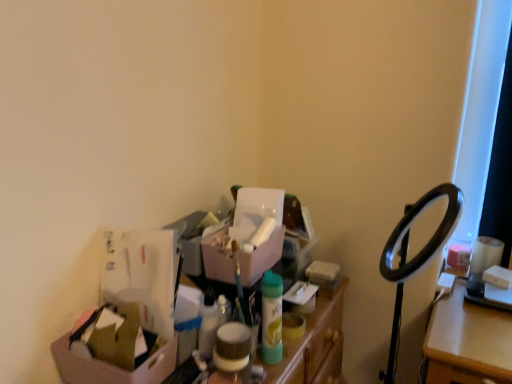
This screenshot has width=512, height=384. What do you see at coordinates (313, 345) in the screenshot? I see `matte plastic storage bin at center` at bounding box center [313, 345].

Image resolution: width=512 pixels, height=384 pixels. Describe the element at coordinates (112, 366) in the screenshot. I see `cardboard box at lower left, acting as the 1th box starting from the left` at that location.

Locate an element on the screen. Image resolution: width=512 pixels, height=384 pixels. matte plastic storage bin at center is located at coordinates (313, 345).

Looking at the image, does matte pink box at center, which ranks as the 2th box in bottom-to-top order, seem bigger or smaller compared to cardboard box at lower left, placed as the 2th box when sorted from back to front?

Clearly, matte pink box at center, which ranks as the 2th box in bottom-to-top order, is larger in size than cardboard box at lower left, placed as the 2th box when sorted from back to front.

Does matte pink box at center, which is counted as the first box, starting from the back, contain cardboard box at lower left, the first box in the bottom-to-top sequence?

Definitely not — cardboard box at lower left, the first box in the bottom-to-top sequence, is not inside matte pink box at center, which is counted as the first box, starting from the back.

From a real-world perspective, is matte pink box at center, which ranks as the 2th box in bottom-to-top order, positioned over cardboard box at lower left, acting as the 1th box starting from the left, based on gravity?

Yes, from a real-world perspective, matte pink box at center, which ranks as the 2th box in bottom-to-top order, is over cardboard box at lower left, acting as the 1th box starting from the left

Is matte pink box at center, positioned as the first box in top-to-bottom order, further to camera compared to cardboard box at lower left, the first box in the bottom-to-top sequence?

Yes, matte pink box at center, positioned as the first box in top-to-bottom order, is behind cardboard box at lower left, the first box in the bottom-to-top sequence.

Find the location of a particular element. Image resolution: width=512 pixels, height=384 pixels. the 2nd box to the left when counting from the matte plastic storage bin at center is located at coordinates (112, 366).

How far apart are matte plastic storage bin at center and cardboard box at lower left, placed as the 2th box when sorted from back to front?

They are 14.16 inches apart.

From their relative heights in the image, would you say matte plastic storage bin at center is taller or shorter than cardboard box at lower left, the first box in the bottom-to-top sequence?

matte plastic storage bin at center is taller than cardboard box at lower left, the first box in the bottom-to-top sequence.

Is point (332, 325) closer to viewer compared to point (75, 363)?

No, (332, 325) is further to viewer.

Considering their positions, is cardboard box at lower left, which is the second box in right-to-left order, located in front of or behind matte plastic storage bin at center?

Visually, cardboard box at lower left, which is the second box in right-to-left order, is located in front of matte plastic storage bin at center.

Which is more to the right, cardboard box at lower left, the first box in the bottom-to-top sequence, or matte plastic storage bin at center?

From the viewer's perspective, matte plastic storage bin at center appears more on the right side.

From the image's perspective, relative to matte plastic storage bin at center, is cardboard box at lower left, acting as the 1th box starting from the left, above or below?

cardboard box at lower left, acting as the 1th box starting from the left, is situated higher than matte plastic storage bin at center in the image.

Is cardboard box at lower left, placed as the 2th box when sorted from back to front, situated inside matte plastic storage bin at center or outside?

cardboard box at lower left, placed as the 2th box when sorted from back to front, is located beyond the bounds of matte plastic storage bin at center.

Is matte plastic storage bin at center not near matte pink box at center, the second box when ordered from front to back?

No, there isn't a large distance between matte plastic storage bin at center and matte pink box at center, the second box when ordered from front to back.

Could matte pink box at center, positioned as the second box in left-to-right order, be considered to be inside matte plastic storage bin at center?

Actually, matte pink box at center, positioned as the second box in left-to-right order, is outside matte plastic storage bin at center.

Is matte plastic storage bin at center turned away from matte pink box at center, positioned as the second box in left-to-right order?

No, matte plastic storage bin at center is not facing away from matte pink box at center, positioned as the second box in left-to-right order.

Which of these two, matte plastic storage bin at center or matte pink box at center, the second box when ordered from front to back, is smaller?

matte pink box at center, the second box when ordered from front to back, is smaller.

Is cardboard box at lower left, acting as the 1th box starting from the left, placed right next to matte pink box at center, which is counted as the first box, starting from the back?

No, cardboard box at lower left, acting as the 1th box starting from the left, is not beside matte pink box at center, which is counted as the first box, starting from the back.

Which of these two, cardboard box at lower left, the 1th box when ordered from front to back, or matte pink box at center, the first box from the right, is bigger?

matte pink box at center, the first box from the right, is bigger.

At what (x,y) coordinates should I click in order to perform the action: click on box that appears in front of the matte pink box at center, the first box from the right. Please return your answer as a coordinate pair (x, y). The image size is (512, 384). Looking at the image, I should click on (112, 366).

Does cardboard box at lower left, the 1th box when ordered from front to back, have a lesser width compared to matte pink box at center, which ranks as the 2th box in bottom-to-top order?

No, cardboard box at lower left, the 1th box when ordered from front to back, is not thinner than matte pink box at center, which ranks as the 2th box in bottom-to-top order.

From the matte plastic storage bin at center, count the 1st box to the left and point to it. Please provide its 2D coordinates.

[(247, 237)]

From their relative heights in the image, would you say matte pink box at center, the first box from the right, is taller or shorter than matte plastic storage bin at center?

Clearly, matte pink box at center, the first box from the right, is shorter compared to matte plastic storage bin at center.

From a real-world perspective, which object stands above the other?

matte pink box at center, the second box when ordered from front to back.

This screenshot has height=384, width=512. I want to click on box below the matte pink box at center, the second box when ordered from front to back (from the image's perspective), so click(x=112, y=366).

Which box is the 2nd one when counting from the left side of the matte plastic storage bin at center? Please provide its 2D coordinates.

[(112, 366)]

Considering their positions, is matte plastic storage bin at center positioned further to matte pink box at center, positioned as the second box in left-to-right order, than cardboard box at lower left, the first box in the bottom-to-top sequence?

cardboard box at lower left, the first box in the bottom-to-top sequence, lies further to matte pink box at center, positioned as the second box in left-to-right order, than the other object.

From the image, which object appears to be farther from matte plastic storage bin at center, cardboard box at lower left, placed as the 2th box when sorted from back to front, or matte pink box at center, positioned as the first box in top-to-bottom order?

cardboard box at lower left, placed as the 2th box when sorted from back to front, is further to matte plastic storage bin at center.

Estimate the real-world distances between objects in this image. Which object is closer to cardboard box at lower left, acting as the 1th box starting from the left, matte plastic storage bin at center or matte pink box at center, positioned as the first box in top-to-bottom order?

matte plastic storage bin at center is positioned closer to the anchor cardboard box at lower left, acting as the 1th box starting from the left.

Estimate the real-world distances between objects in this image. Which object is further from matte plastic storage bin at center, matte pink box at center, which is counted as the first box, starting from the back, or cardboard box at lower left, placed as the 2th box when sorted from back to front?

Among the two, cardboard box at lower left, placed as the 2th box when sorted from back to front, is located further to matte plastic storage bin at center.

Which object lies nearer to the anchor point cardboard box at lower left, placed as the 2th box when sorted from back to front, matte pink box at center, positioned as the second box in left-to-right order, or matte plastic storage bin at center?

Among the two, matte plastic storage bin at center is located nearer to cardboard box at lower left, placed as the 2th box when sorted from back to front.

Considering their positions, is cardboard box at lower left, the 1th box when ordered from front to back, positioned closer to matte pink box at center, the second box when ordered from front to back, than matte plastic storage bin at center?

matte plastic storage bin at center is closer to matte pink box at center, the second box when ordered from front to back.

You are a GUI agent. You are given a task and a screenshot of the screen. Output one action in this format:
    pyautogui.click(x=<x>, y=<y>)
    Task: Click on the box between matte pink box at center, positioned as the second box in left-to-right order, and matte plastic storage bin at center, in the vertical direction
    The width and height of the screenshot is (512, 384).
    Given the screenshot: What is the action you would take?
    pyautogui.click(x=112, y=366)